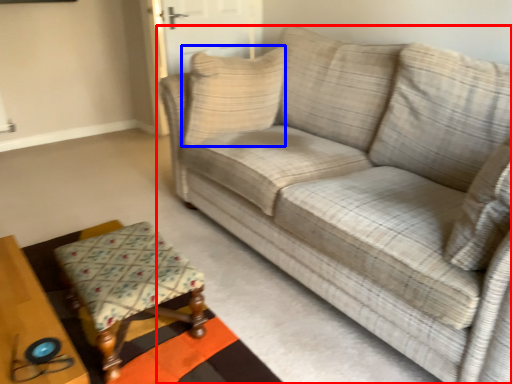
Question: Which of the following is the farthest to the observer, studio couch (highlighted by a red box) or pillow (highlighted by a blue box)?

Choices:
 (A) studio couch
 (B) pillow

Answer: (B)